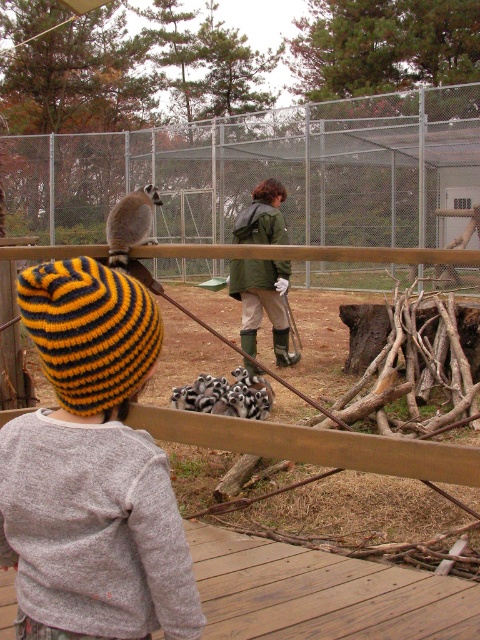
Question: Is metal fence at upper center bigger than ring-tailed lemur at center?

Choices:
 (A) no
 (B) yes

Answer: (B)

Question: Among these objects, which one is farthest from the camera?

Choices:
 (A) ring-tailed lemur at center
 (B) green matte jacket at center

Answer: (B)

Question: From the image, what is the correct spatial relationship of green matte jacket at center in relation to ring-tailed lemur at center?

Choices:
 (A) right
 (B) left

Answer: (A)

Question: Which point appears farthest from the camera in this image?

Choices:
 (A) (147, 593)
 (B) (163, 136)
 (C) (210, 410)
 (D) (129, 250)

Answer: (B)

Question: Observing the image, what is the correct spatial positioning of yellow and black knitted beanie at upper left in reference to black and white striped lemur at center?

Choices:
 (A) above
 (B) below

Answer: (A)

Question: Among these points, which one is farthest from the camera?

Choices:
 (A) (243, 396)
 (B) (268, 192)

Answer: (B)